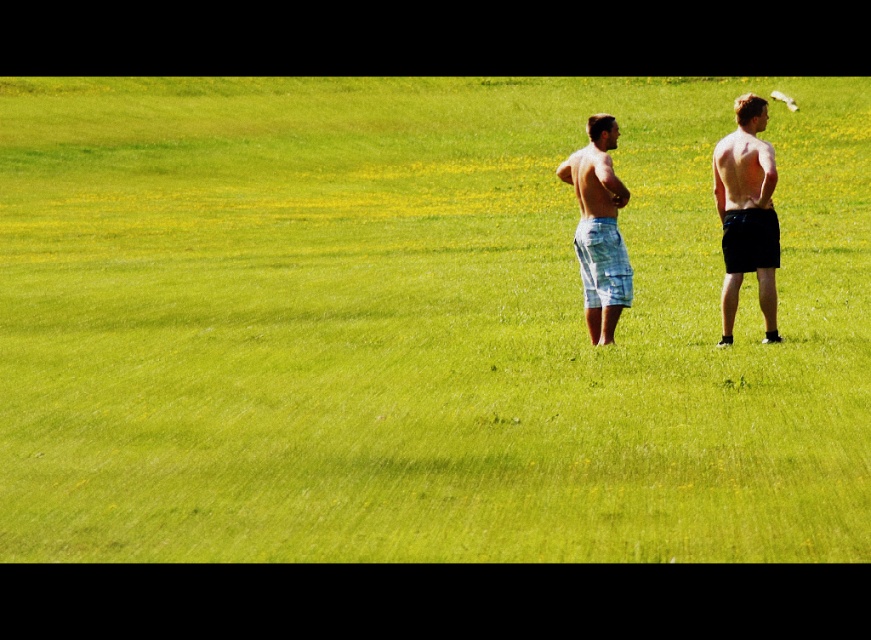
Question: Is black matte shorts at right in front of light blue plaid shorts at center?

Choices:
 (A) no
 (B) yes

Answer: (B)

Question: Which point appears closest to the camera in this image?

Choices:
 (A) (738, 124)
 (B) (628, 301)

Answer: (B)

Question: Can you confirm if black matte shorts at right is bigger than light blue plaid shorts at center?

Choices:
 (A) no
 (B) yes

Answer: (B)

Question: Which point is closer to the camera?

Choices:
 (A) (591, 234)
 (B) (726, 236)

Answer: (A)

Question: Which of the following is the farthest from the observer?

Choices:
 (A) black matte shorts at right
 (B) light blue plaid shorts at center

Answer: (B)

Question: Can you confirm if black matte shorts at right is wider than light blue plaid shorts at center?

Choices:
 (A) no
 (B) yes

Answer: (A)